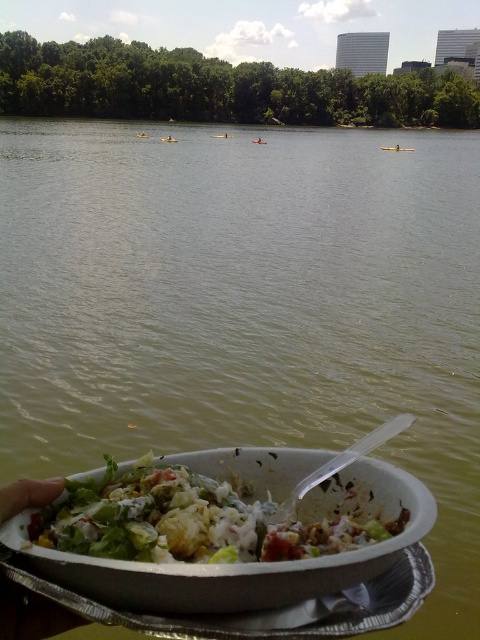
Is fresh green salad at lower center in front of metallic gold kayak at center?

Yes, fresh green salad at lower center is closer to the viewer.

Which is behind, point (222, 556) or point (392, 147)?

The point (392, 147) is behind.

Which is behind, point (355, 522) or point (396, 145)?

Positioned behind is point (396, 145).

You are a GUI agent. You are given a task and a screenshot of the screen. Output one action in this format:
    pyautogui.click(x=<x>, y=<y>)
    Task: Click on the fresh green salad at lower center
    
    Given the screenshot: What is the action you would take?
    pyautogui.click(x=197, y=518)

Is metallic gold kayak at center closer to the viewer compared to yellow plastic kayak at center?

That is False.

Can you confirm if metallic gold kayak at center is shorter than yellow plastic kayak at center?

Correct, metallic gold kayak at center is not as tall as yellow plastic kayak at center.

Is point (396, 147) closer to camera compared to point (164, 140)?

No, (396, 147) is further to viewer.

Identify the location of metallic gold kayak at center. The image size is (480, 640). (396, 148).

Locate an element on the screen. The width and height of the screenshot is (480, 640). fresh green salad at lower center is located at coordinates (197, 518).

Does fresh green salad at lower center have a lesser height compared to yellow plastic kayak at center?

Yes.

Find the location of a particular element. fresh green salad at lower center is located at coordinates (197, 518).